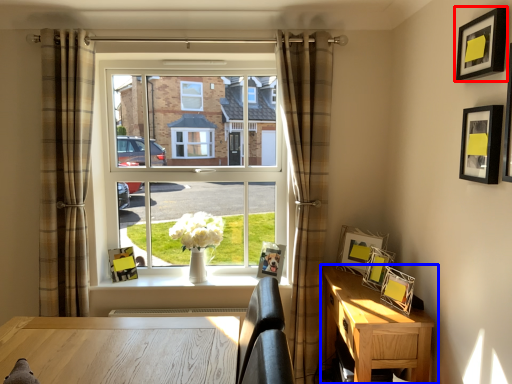
Question: Which object appears closest to the camera in this image, picture frame (highlighted by a red box) or nightstand (highlighted by a blue box)?

Choices:
 (A) picture frame
 (B) nightstand

Answer: (A)